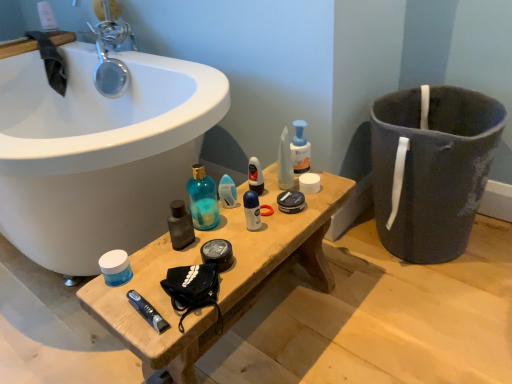
Find the location of a particular element. The image size is (512, 384). vacant area to the left of blue matte toothpaste at center is located at coordinates (110, 301).